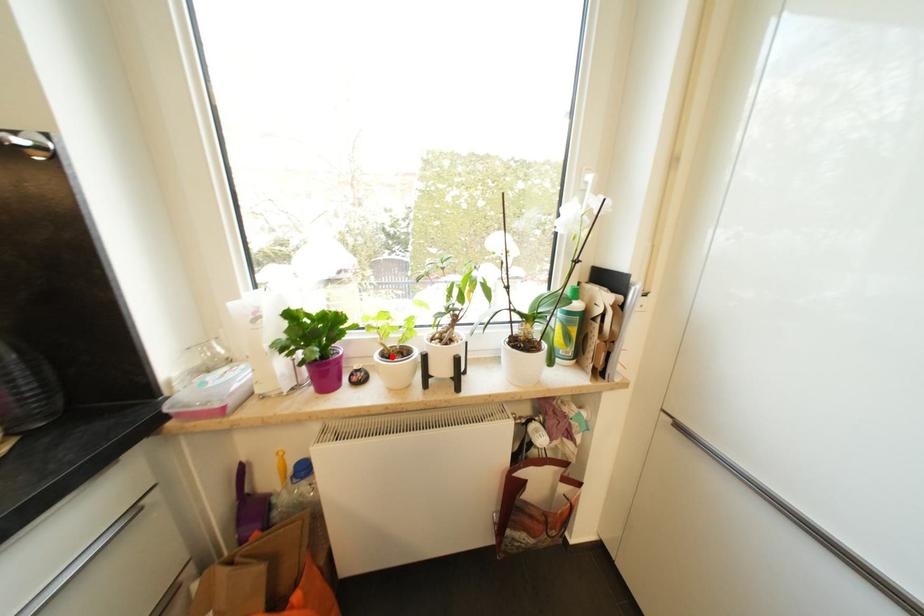
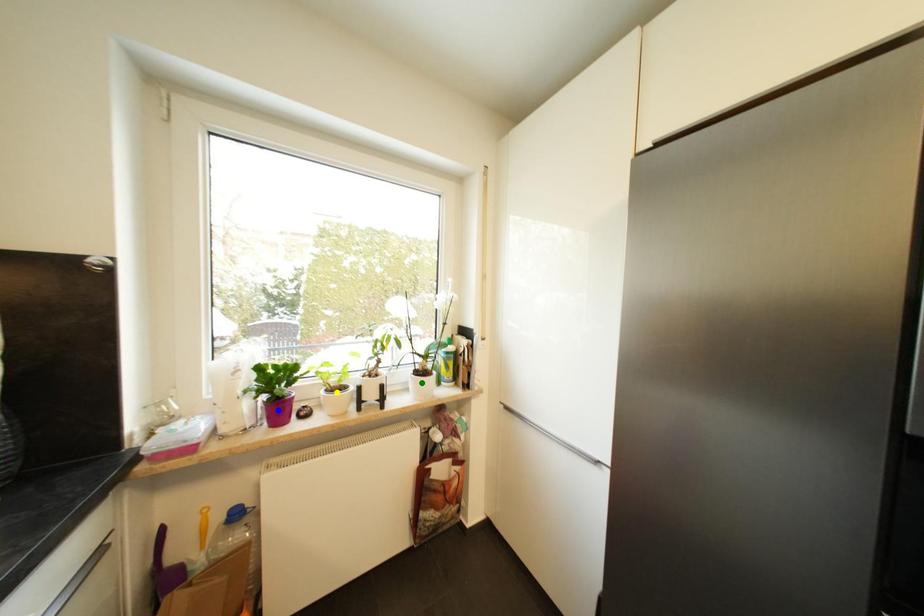
Question: I am providing you with two images of the same scene from different viewpoints. A red point is marked on the first image. You are given multiple points on the second image. Which mark in image 2 goes with the point in image 1?

Choices:
 (A) blue point
 (B) yellow point
 (C) green point

Answer: (B)